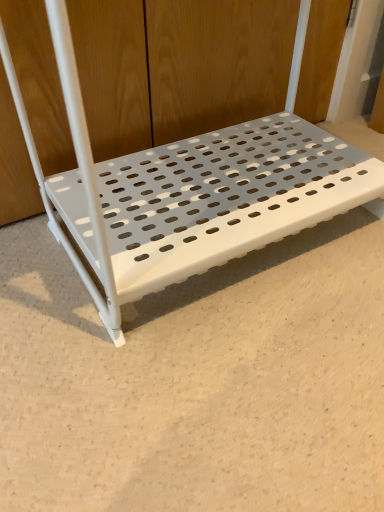
Locate an element on the screen. white perforated shelf at center is located at coordinates (185, 192).

What do you see at coordinates (185, 192) in the screenshot?
I see `white perforated shelf at center` at bounding box center [185, 192].

At what (x,y) coordinates should I click in order to perform the action: click on white perforated shelf at center. Please return your answer as a coordinate pair (x, y). The image size is (384, 512). Looking at the image, I should click on (185, 192).